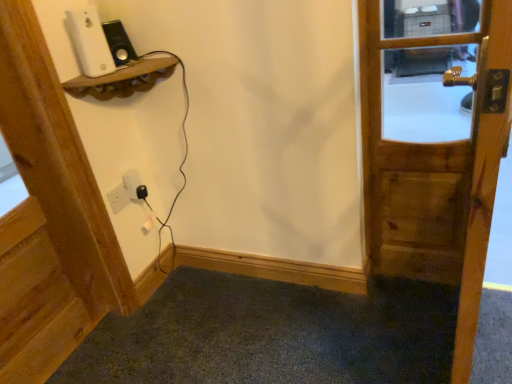
Question: From the image's perspective, is black plastic plug at lower center located above or below wooden door at upper left, which ranks as the first door in left-to-right order?

Choices:
 (A) below
 (B) above

Answer: (B)

Question: Looking at their shapes, would you say black plastic plug at lower center is wider or thinner than wooden door at upper left, which ranks as the first door in left-to-right order?

Choices:
 (A) wide
 (B) thin

Answer: (B)

Question: Which of these objects is positioned farthest from the wooden door handle at right, acting as the second door starting from the left?

Choices:
 (A) white matte ipod at upper left
 (B) wooden door at upper left, which ranks as the first door in left-to-right order
 (C) black plastic plug at lower center

Answer: (B)

Question: Which is farther from the white matte ipod at upper left?

Choices:
 (A) wooden door at upper left, which ranks as the first door in left-to-right order
 (B) wooden door handle at right, acting as the second door starting from the left
 (C) black plastic plug at lower center

Answer: (B)